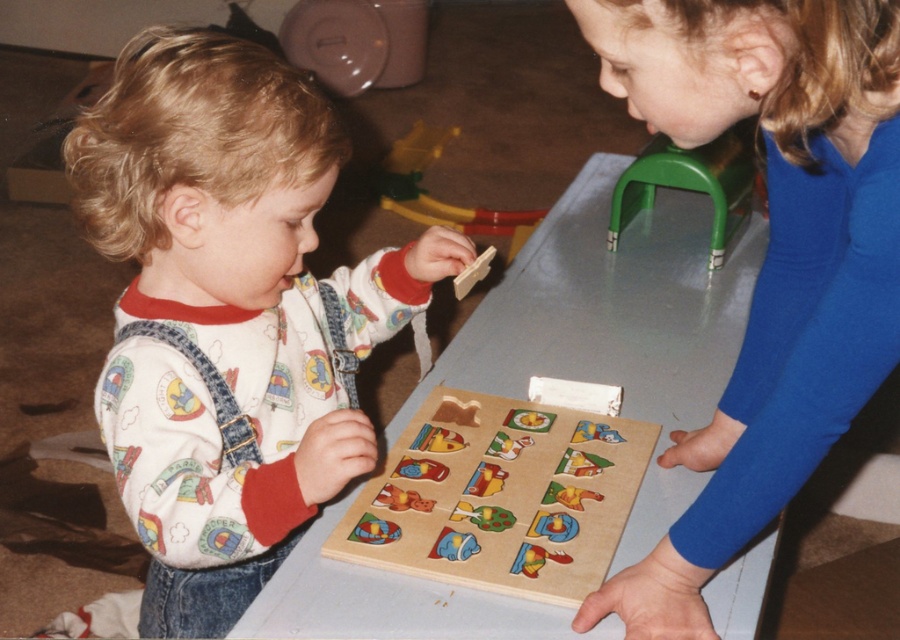
Can you confirm if white cotton shirt at center is positioned below green plastic stool at upper center?

Yes.

Can you confirm if white cotton shirt at center is positioned to the right of green plastic stool at upper center?

Incorrect, white cotton shirt at center is not on the right side of green plastic stool at upper center.

Which is behind, point (171, 332) or point (659, 186)?

Positioned behind is point (659, 186).

Find the location of `white cotton shirt at center`. white cotton shirt at center is located at coordinates (230, 314).

Measure the distance between point (680, 538) and camera.

Point (680, 538) is 34.83 inches away from camera.

Does point (792, 410) come closer to viewer compared to point (333, 538)?

That is True.

Where is `blue smooth shirt at upper right`? This screenshot has height=640, width=900. blue smooth shirt at upper right is located at coordinates (770, 412).

The width and height of the screenshot is (900, 640). I want to click on blue smooth shirt at upper right, so click(x=770, y=412).

Which is below, blue smooth shirt at upper right or green plastic stool at upper center?

blue smooth shirt at upper right is lower down.

Does point (703, 502) come closer to viewer compared to point (736, 188)?

Yes, it is in front of point (736, 188).

Locate an element on the screen. The width and height of the screenshot is (900, 640). blue smooth shirt at upper right is located at coordinates (770, 412).